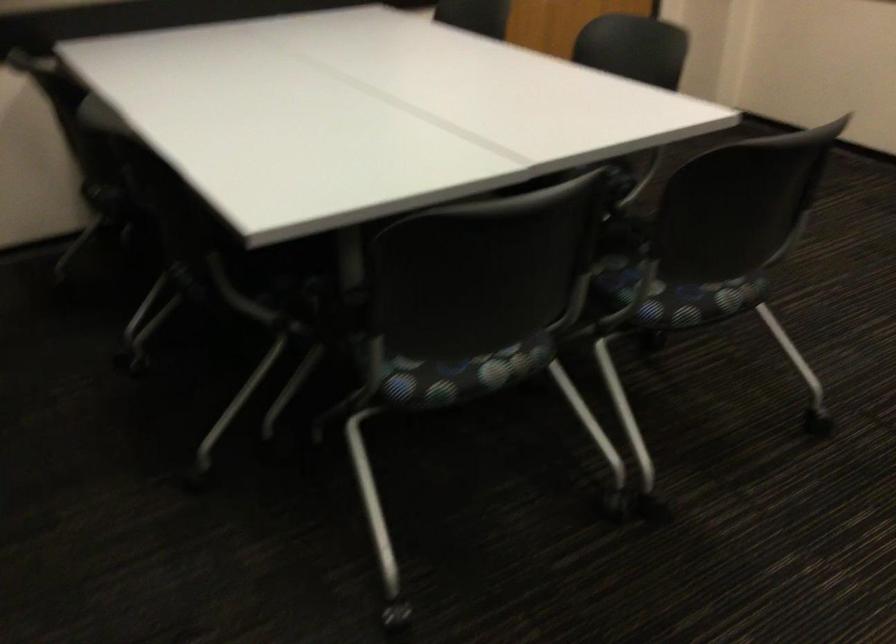
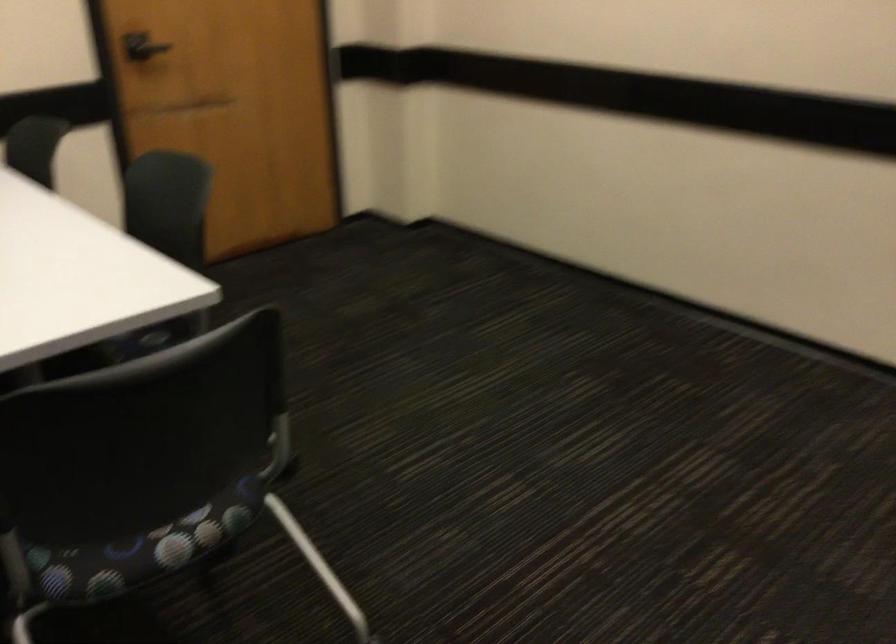
Question: Based on the continuous images, in which direction is the camera rotating? Reply with the corresponding letter.

Choices:
 (A) Left
 (B) Right
 (C) Up
 (D) Down

Answer: (B)